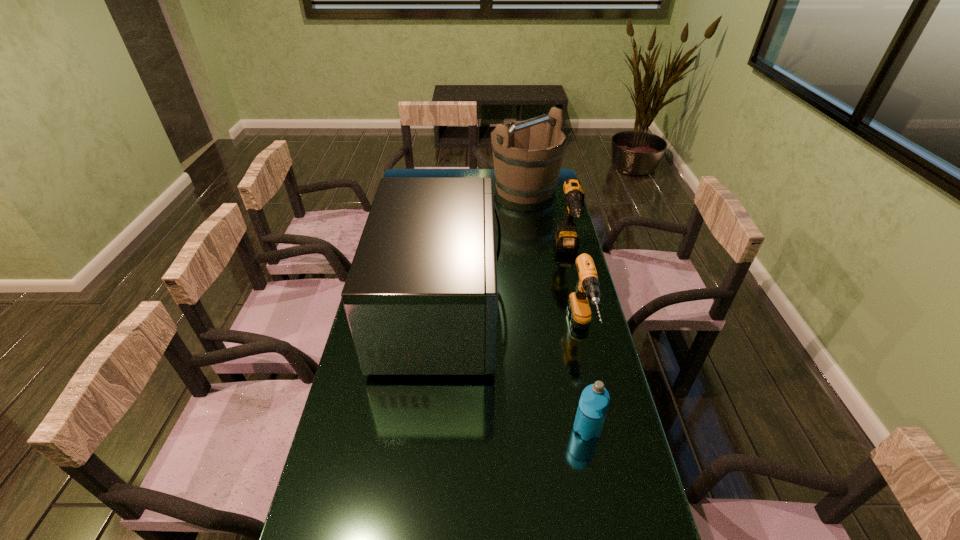
This screenshot has height=540, width=960. In order to click on bucket in this screenshot , I will do `click(523, 176)`.

This screenshot has height=540, width=960. What are the coordinates of `microwave oven` in the screenshot? It's located at (421, 296).

The image size is (960, 540). Find the location of `the third shortest object`. the third shortest object is located at coordinates (566, 239).

In order to click on the farther drill in this screenshot , I will do `click(566, 239)`.

Identify the location of the shorter drill. This screenshot has width=960, height=540. (587, 288).

Where is `thermos bottle`? The width and height of the screenshot is (960, 540). thermos bottle is located at coordinates (594, 402).

Locate an element on the screen. The height and width of the screenshot is (540, 960). vacant area situated on the left of the farthest object is located at coordinates (448, 189).

Identify the location of vacant space located on the front-facing side of the microwave oven. The width and height of the screenshot is (960, 540). (592, 309).

Find the location of a particular element. The image size is (960, 540). free region located 0.200m at the tip of the taller drill is located at coordinates click(581, 307).

Where is `blank area located 0.120m at the tip of the nearer drill`? The width and height of the screenshot is (960, 540). blank area located 0.120m at the tip of the nearer drill is located at coordinates (599, 403).